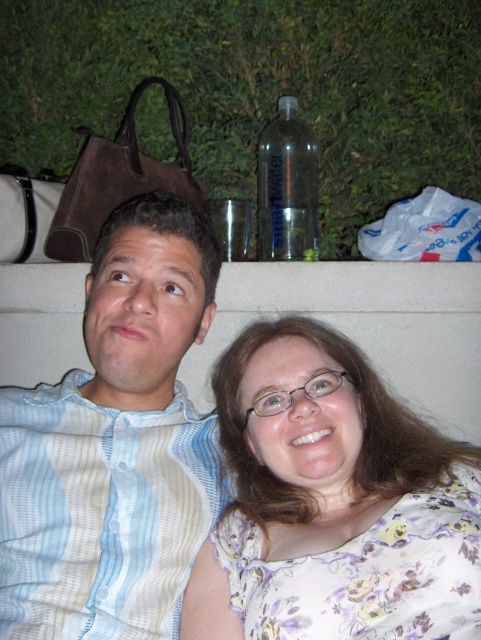
You are a photographer trying to capture a closeup of the floral fabric blouse at lower right. Based on the coordinates provided in the Objects Description, can you determine if the blouse is positioned within the central area of the image?

The floral fabric blouse at lower right is located at point (x=332, y=502), which is outside the central area of the image since the central area would typically be around coordinates closer to (x=240, y=320). Therefore, the blouse is not in the center.

You are a photographer standing at the camera position. You want to place a small decorative item between the white striped shirt at upper left and the camera. The item is 12 inches long. Is there enough space to fit it without overlapping either the shirt or the camera?

The distance between the white striped shirt at upper left and the camera is 31.70 inches. Since the item is 12 inches long, there is sufficient space to place it between them without overlapping either the shirt or the camera.

You are a photographer trying to capture a candid shot of the two people in the scene. Since you want to ensure the light blue striped shirt at left and the floral fabric blouse at lower right are both visible in the frame, which direction should you position yourself relative to the subjects to capture both clothing items clearly?

To capture both the light blue striped shirt at left and the floral fabric blouse at lower right clearly, position yourself to the right side of the subjects. This way, the floral fabric blouse at lower right will be visible to your left and the light blue striped shirt at left will be on your right, ensuring both are in the frame.